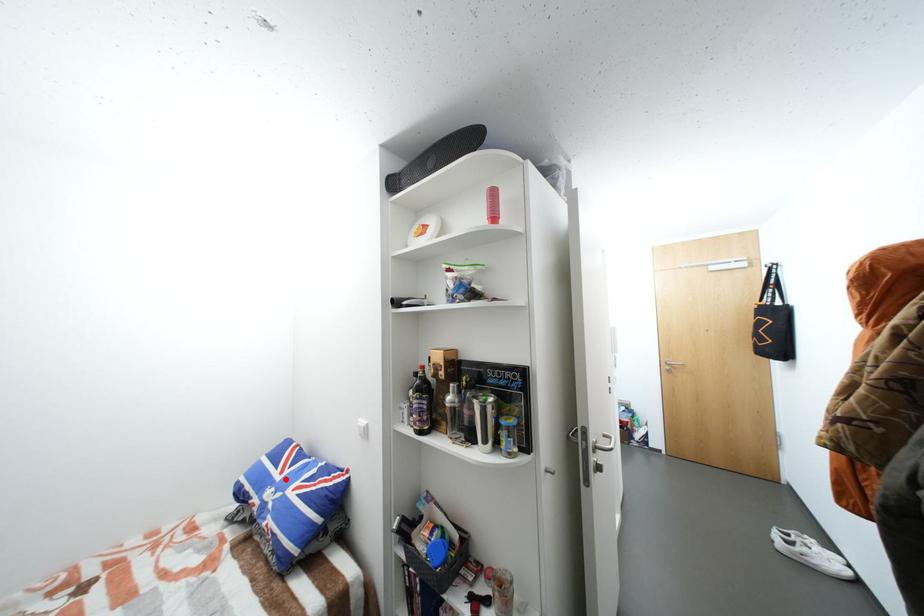
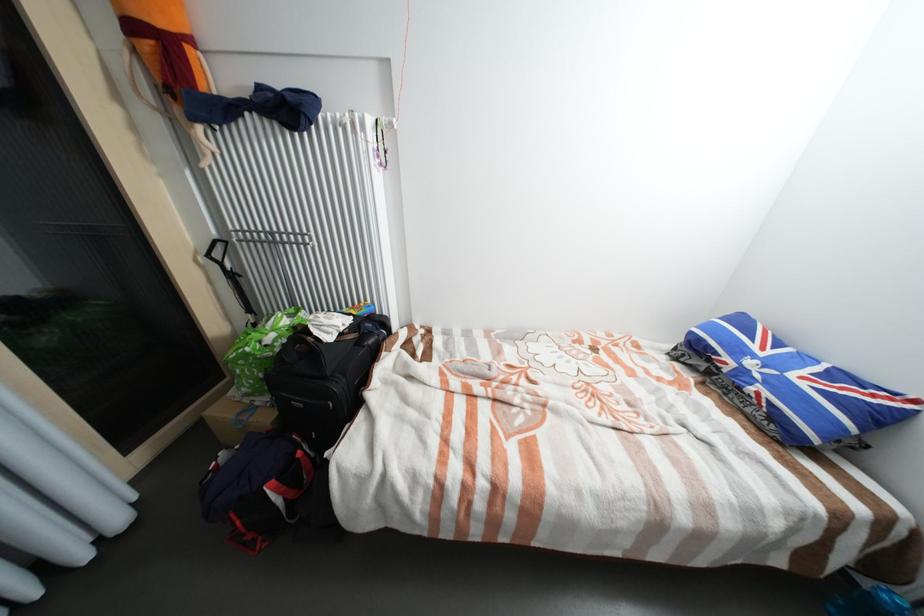
Locate, in the second image, the point that corresponds to the highlighted location in the first image.

(769, 354)